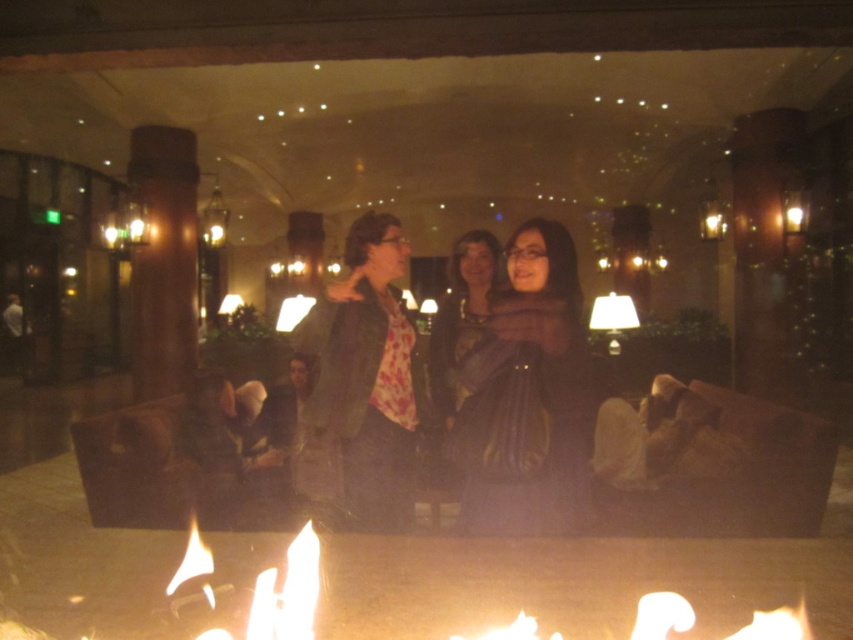
Does silky black dress at center appear on the right side of matte black jacket at center?

Correct, you'll find silky black dress at center to the right of matte black jacket at center.

Is point (537, 461) in front of point (357, 518)?

Yes, point (537, 461) is in front of point (357, 518).

Does point (566, 289) come behind point (392, 467)?

No.

Find the location of a particular element. The width and height of the screenshot is (853, 640). silky black dress at center is located at coordinates (527, 396).

Is flamefire at lower center wider than matte black jacket at center?

Yes, flamefire at lower center is wider than matte black jacket at center.

Does flamefire at lower center have a lesser width compared to matte black jacket at center?

No, flamefire at lower center is not thinner than matte black jacket at center.

Between point (630, 595) and point (380, 250), which one is positioned behind?

Point (380, 250)

Where is `flamefire at lower center`? This screenshot has height=640, width=853. flamefire at lower center is located at coordinates (572, 582).

Who is positioned more to the right, flamefire at lower center or silky black dress at center?

From the viewer's perspective, silky black dress at center appears more on the right side.

Is point (401, 552) farther from camera compared to point (518, 364)?

No, (401, 552) is in front of (518, 364).

Image resolution: width=853 pixels, height=640 pixels. What are the coordinates of `flamefire at lower center` in the screenshot? It's located at (572, 582).